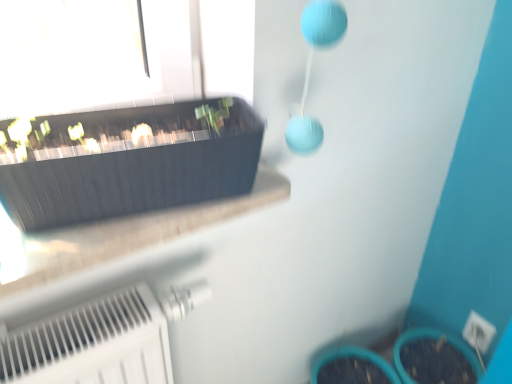
Question: From a real-world perspective, does white plastic electric outlet at lower right stand above matte black flowerpot at upper left?

Choices:
 (A) no
 (B) yes

Answer: (A)

Question: Is white plastic electric outlet at lower right aimed at matte black flowerpot at upper left?

Choices:
 (A) no
 (B) yes

Answer: (A)

Question: Is white plastic electric outlet at lower right closer to the viewer compared to matte black flowerpot at upper left?

Choices:
 (A) no
 (B) yes

Answer: (A)

Question: Is white plastic electric outlet at lower right to the left of matte black flowerpot at upper left from the viewer's perspective?

Choices:
 (A) no
 (B) yes

Answer: (A)

Question: Are white plastic electric outlet at lower right and matte black flowerpot at upper left located far from each other?

Choices:
 (A) no
 (B) yes

Answer: (B)

Question: Is white plastic electric outlet at lower right positioned with its back to matte black flowerpot at upper left?

Choices:
 (A) yes
 (B) no

Answer: (B)

Question: Is there a large distance between matte black flowerpot at upper left and white plastic electric outlet at lower right?

Choices:
 (A) no
 (B) yes

Answer: (B)

Question: Are matte black flowerpot at upper left and white plastic electric outlet at lower right beside each other?

Choices:
 (A) yes
 (B) no

Answer: (B)

Question: From a real-world perspective, is matte black flowerpot at upper left physically above white plastic electric outlet at lower right?

Choices:
 (A) no
 (B) yes

Answer: (B)

Question: Is matte black flowerpot at upper left thinner than white plastic electric outlet at lower right?

Choices:
 (A) yes
 (B) no

Answer: (B)

Question: Can you confirm if matte black flowerpot at upper left is shorter than white plastic electric outlet at lower right?

Choices:
 (A) yes
 (B) no

Answer: (B)

Question: Is matte black flowerpot at upper left at the right side of white plastic electric outlet at lower right?

Choices:
 (A) no
 (B) yes

Answer: (A)

Question: Based on their sizes in the image, would you say white plastic electric outlet at lower right is bigger or smaller than matte black flowerpot at upper left?

Choices:
 (A) big
 (B) small

Answer: (B)